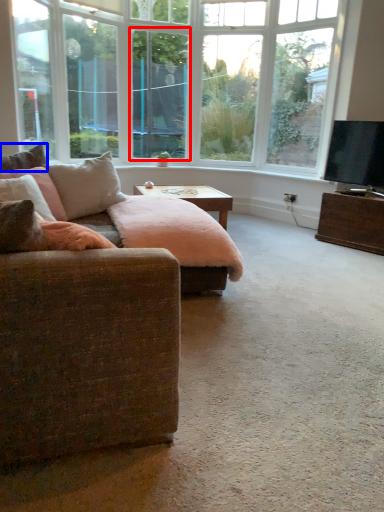
Question: Which object appears closest to the camera in this image, window screen (highlighted by a red box) or pillow (highlighted by a blue box)?

Choices:
 (A) window screen
 (B) pillow

Answer: (B)